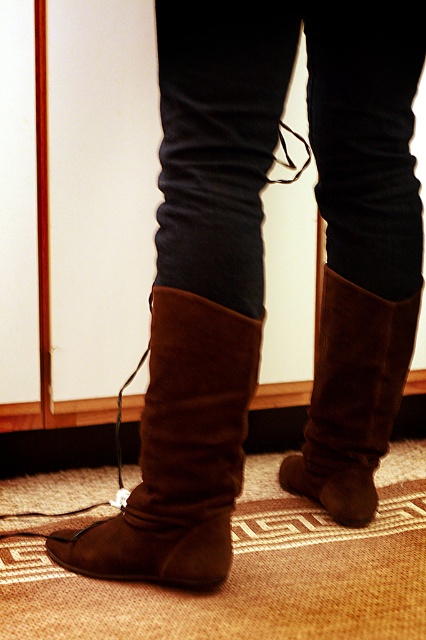
You are trying to decide which boot to wear for a walk. Both the suede boot at lower left and the brown suede boot at lower center are options. Which boot has a greater width?

The suede boot at lower left might be wider than brown suede boot at lower center.

You are designing a shoe organizer that needs to accommodate both the suede boot at lower left and the brown suede boot at lower center. Based on their sizes, which boot requires a larger compartment?

The suede boot at lower left requires a larger compartment because it is bigger than the brown suede boot at lower center.

You are a photographer setting up a shoot and notice the suede boot at lower left and the brown suede boot at lower center. Which boot is positioned lower in the image?

The suede boot at lower left is positioned lower in the image than the brown suede boot at lower center.